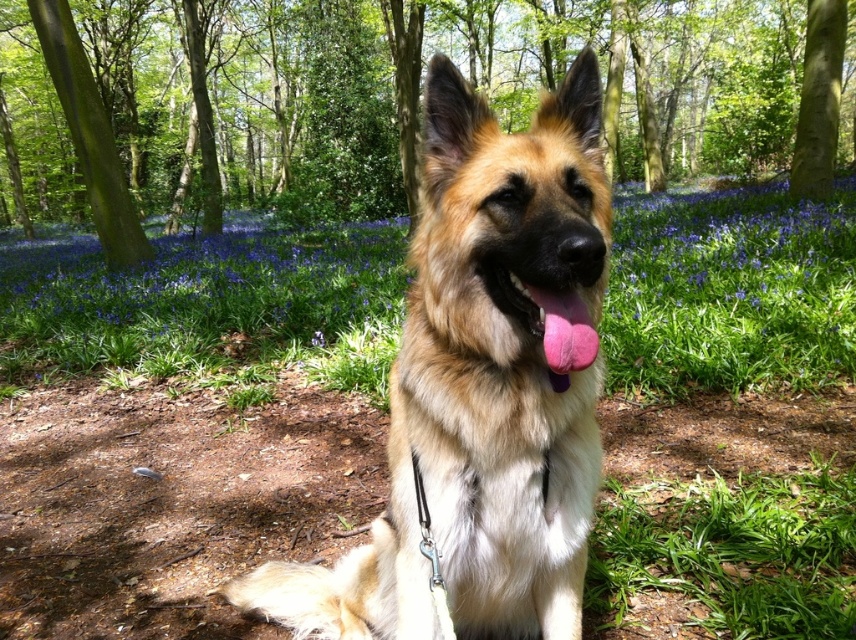
You are a hiker who wants to take a photo of the golden fur dog at center and the green rough bark tree at upper left. Which object should you focus on first if you want to capture both in the same frame without moving the camera?

The golden fur dog at center should be focused on first because it is shorter than the green rough bark tree at upper left, allowing both to fit in the frame by adjusting the camera angle slightly.